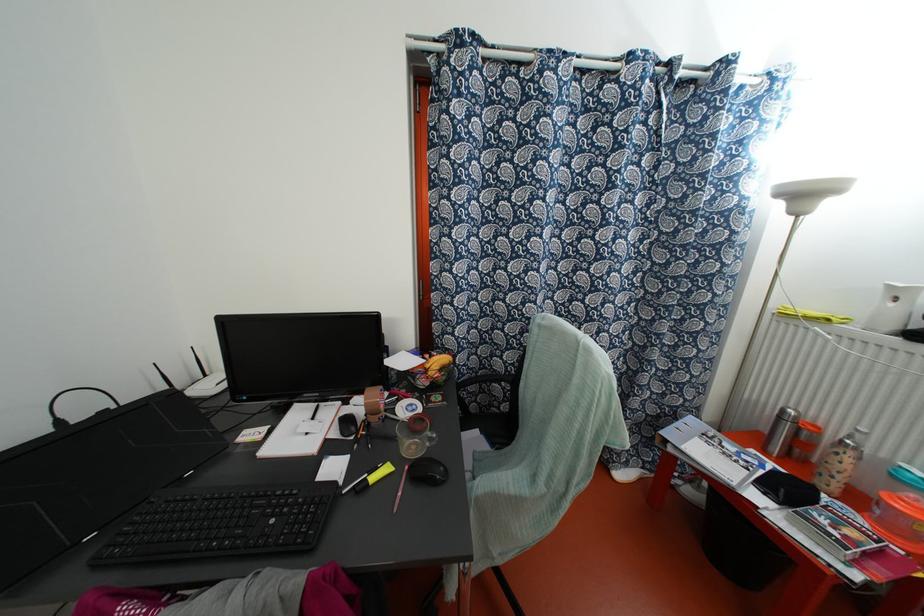
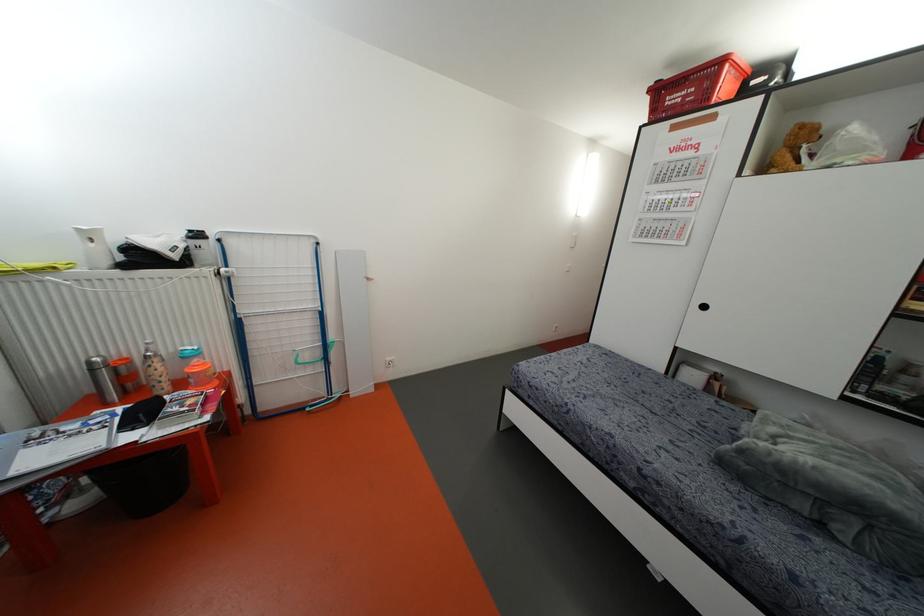
The point at (779, 416) is marked in the first image. Where is the corresponding point in the second image?

(91, 370)